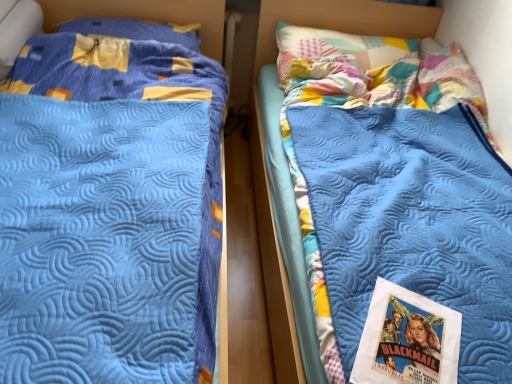
Locate an element on the screen. blue quilted bed at left is located at coordinates (106, 16).

Measure the distance between matte paper poster at lower right and camera.

matte paper poster at lower right and camera are 85.20 centimeters apart.

Where is `blue quilted bed at left`? blue quilted bed at left is located at coordinates (106, 16).

Considering the relative positions of blue quilted mattress at center and blue quilted bed at left in the image provided, is blue quilted mattress at center to the left or to the right of blue quilted bed at left?

Clearly, blue quilted mattress at center is on the right of blue quilted bed at left in the image.

Do you think blue quilted mattress at center is within blue quilted bed at left, or outside of it?

blue quilted mattress at center is located beyond the bounds of blue quilted bed at left.

What's the angular difference between blue quilted mattress at center and blue quilted bed at left's facing directions?

The angle between the facing direction of blue quilted mattress at center and the facing direction of blue quilted bed at left is 0.00858 degrees.

Does matte paper poster at lower right appear on the right side of blue quilted mattress at center?

In fact, matte paper poster at lower right is to the left of blue quilted mattress at center.

Is the depth of matte paper poster at lower right greater than that of blue quilted mattress at center?

Yes, matte paper poster at lower right is further from the camera.

Considering the relative sizes of matte paper poster at lower right and blue quilted mattress at center in the image provided, is matte paper poster at lower right shorter than blue quilted mattress at center?

Yes, matte paper poster at lower right is shorter than blue quilted mattress at center.

Considering the sizes of objects matte paper poster at lower right and blue quilted bed at left in the image provided, who is bigger, matte paper poster at lower right or blue quilted bed at left?

Bigger between the two is blue quilted bed at left.

In the image, is matte paper poster at lower right positioned in front of or behind blue quilted bed at left?

matte paper poster at lower right is behind blue quilted bed at left.

Can you confirm if matte paper poster at lower right is shorter than blue quilted bed at left?

Correct, matte paper poster at lower right is not as tall as blue quilted bed at left.

In the image, is matte paper poster at lower right on the left side or the right side of blue quilted bed at left?

From the image, it's evident that matte paper poster at lower right is to the right of blue quilted bed at left.

Is blue quilted pillow at upper left beside matte paper poster at lower right?

They are not placed beside each other.

From a real-world perspective, between blue quilted pillow at upper left and matte paper poster at lower right, who is vertically lower?

In real-world perspective, matte paper poster at lower right is lower.

Considering the relative sizes of blue quilted pillow at upper left and matte paper poster at lower right in the image provided, is blue quilted pillow at upper left bigger than matte paper poster at lower right?

Correct, blue quilted pillow at upper left is larger in size than matte paper poster at lower right.

Considering the positions of point (191, 37) and point (421, 350), is point (191, 37) closer or farther from the camera than point (421, 350)?

Point (191, 37) is positioned farther from the camera compared to point (421, 350).

Identify the location of bed beneath the matte paper poster at lower right (from a real-world perspective). (106, 16).

Between blue quilted bed at left and matte paper poster at lower right, which one has smaller width?

matte paper poster at lower right.

Considering the positions of objects blue quilted bed at left and matte paper poster at lower right in the image provided, who is more to the left, blue quilted bed at left or matte paper poster at lower right?

blue quilted bed at left.

Is point (393, 230) farther from viewer compared to point (95, 37)?

No, it is not.

Locate an element on the screen. pillow to the left of blue quilted mattress at center is located at coordinates (135, 30).

From the picture: Can you tell me how much blue quilted mattress at center and blue quilted pillow at upper left differ in facing direction?

0.00853 degrees separate the facing orientations of blue quilted mattress at center and blue quilted pillow at upper left.

Is blue quilted pillow at upper left completely or partially inside blue quilted mattress at center?

No.

Is blue quilted pillow at upper left facing away from blue quilted mattress at center?

No, blue quilted pillow at upper left is not facing the opposite direction of blue quilted mattress at center.

Between blue quilted pillow at upper left and blue quilted mattress at center, which one has more height?

blue quilted mattress at center.

How different are the orientations of blue quilted pillow at upper left and blue quilted mattress at center in degrees?

blue quilted pillow at upper left and blue quilted mattress at center are facing 0.00853 degrees away from each other.

Based on the photo, is blue quilted pillow at upper left outside of blue quilted mattress at center?

Indeed, blue quilted pillow at upper left is completely outside blue quilted mattress at center.

What are the coordinates of `bed above the blue quilted mattress at center (from the image's perspective)` in the screenshot? It's located at (106, 16).

This screenshot has height=384, width=512. I want to click on comic book to the left of blue quilted mattress at center, so click(x=407, y=339).

Estimate the real-world distances between objects in this image. Which object is further from matte paper poster at lower right, blue quilted pillow at upper left or blue quilted mattress at center?

blue quilted pillow at upper left is positioned further to the anchor matte paper poster at lower right.

Based on their spatial positions, is blue quilted mattress at center or matte paper poster at lower right further from blue quilted pillow at upper left?

matte paper poster at lower right is further to blue quilted pillow at upper left.

Considering their positions, is blue quilted pillow at upper left positioned closer to blue quilted bed at left than matte paper poster at lower right?

blue quilted pillow at upper left lies closer to blue quilted bed at left than the other object.

Based on their spatial positions, is blue quilted mattress at center or blue quilted pillow at upper left closer to matte paper poster at lower right?

The object closer to matte paper poster at lower right is blue quilted mattress at center.

When comparing their distances from blue quilted pillow at upper left, does blue quilted bed at left or blue quilted mattress at center seem closer?

blue quilted bed at left lies closer to blue quilted pillow at upper left than the other object.

Looking at the image, which one is located further to blue quilted bed at left, blue quilted pillow at upper left or blue quilted mattress at center?

blue quilted mattress at center lies further to blue quilted bed at left than the other object.

Looking at the image, which one is located closer to blue quilted mattress at center, matte paper poster at lower right or blue quilted bed at left?

matte paper poster at lower right is closer to blue quilted mattress at center.

Considering their positions, is matte paper poster at lower right positioned further to blue quilted bed at left than blue quilted pillow at upper left?

matte paper poster at lower right lies further to blue quilted bed at left than the other object.

Locate an element on the screen. comic book located between blue quilted bed at left and blue quilted mattress at center in the left-right direction is located at coordinates (407, 339).

Image resolution: width=512 pixels, height=384 pixels. I want to click on comic book between blue quilted mattress at center and blue quilted pillow at upper left in the front-back direction, so click(407, 339).

At what (x,y) coordinates should I click in order to perform the action: click on comic book between blue quilted bed at left and blue quilted pillow at upper left from front to back. Please return your answer as a coordinate pair (x, y). Image resolution: width=512 pixels, height=384 pixels. Looking at the image, I should click on (407, 339).

Where is `mattress located between blue quilted bed at left and blue quilted pillow at upper left in the depth direction`? mattress located between blue quilted bed at left and blue quilted pillow at upper left in the depth direction is located at coordinates (412, 221).